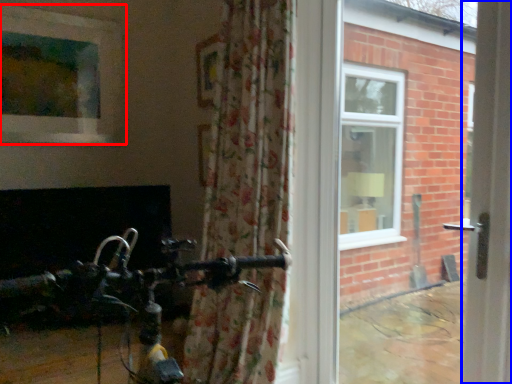
Question: Which object appears farthest to the camera in this image, window (highlighted by a red box) or screen door (highlighted by a blue box)?

Choices:
 (A) window
 (B) screen door

Answer: (A)